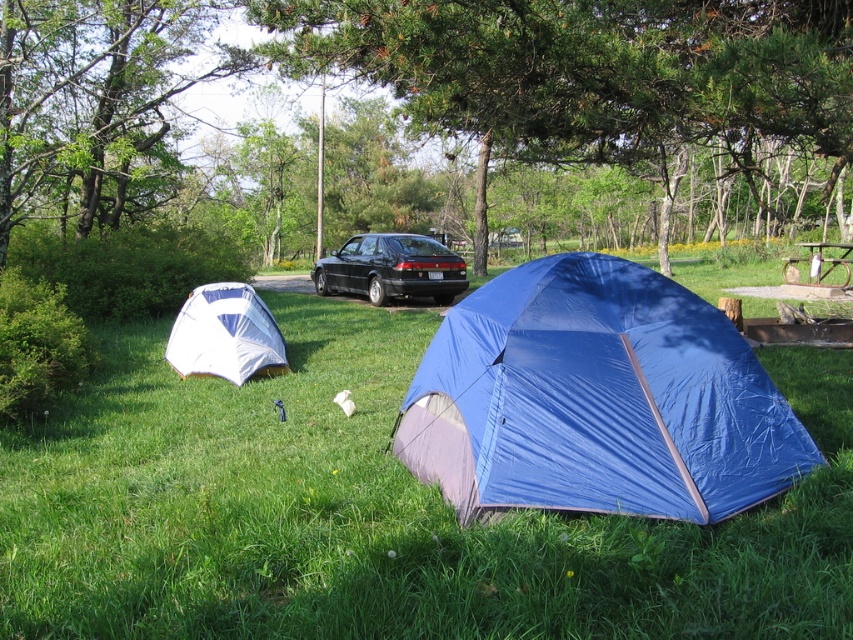
You are standing at the edge of the camping area and want to place a new tent. You have two points marked as potential locations for the tent. Which point is closer to you? The points are point (300,32) and point (431,252).

Point (300,32) is closer to the viewer than point (431,252), so you should choose point (300,32) as it is nearer to your current position.

You are planning to set up a new tent in the camping area. The blue tarpaulin tent at center and the rustic wood picnic table at center are already present. Which object takes up more space in the camping area?

The rustic wood picnic table at center occupies more space than the blue tarpaulin tent at center.